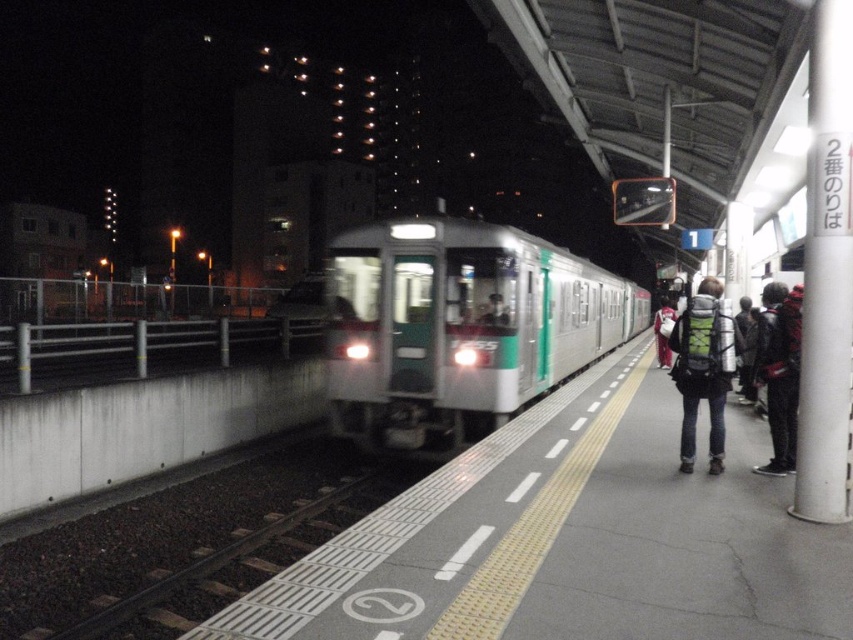
Is green metallic train at center closer to camera compared to red backpack at right?

That is False.

Is green metallic train at center thinner than red backpack at right?

No.

Between point (422, 340) and point (767, 285), which one is positioned behind?

Point (767, 285)

I want to click on green metallic train at center, so click(459, 326).

Is point (556, 353) closer to viewer compared to point (680, 435)?

That is False.

Can you confirm if green metallic train at center is taller than green backpack at center?

Indeed, green metallic train at center has a greater height compared to green backpack at center.

Consider the image. Who is more distant from viewer, (575, 330) or (706, 292)?

Point (575, 330)

Where is `green metallic train at center`? This screenshot has height=640, width=853. green metallic train at center is located at coordinates (459, 326).

Between green backpack at center and red backpack at right, which one has less height?

Standing shorter between the two is red backpack at right.

Is green backpack at center smaller than red backpack at right?

Incorrect, green backpack at center is not smaller in size than red backpack at right.

Find the location of `green backpack at center`. green backpack at center is located at coordinates (703, 369).